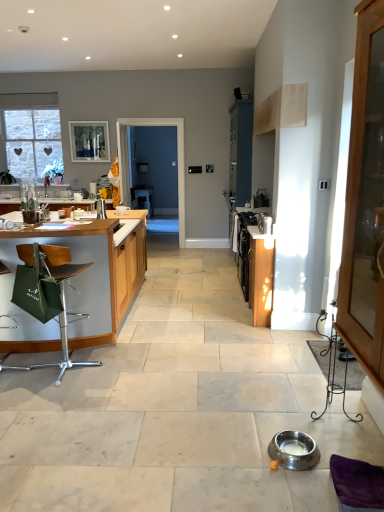
You are a GUI agent. You are given a task and a screenshot of the screen. Output one action in this format:
    pyautogui.click(x=<x>, y=<y>)
    Task: Click on the free space to the back side of purple fabric swivel chair at lower right
    The image size is (384, 512).
    Given the screenshot: What is the action you would take?
    pyautogui.click(x=345, y=454)